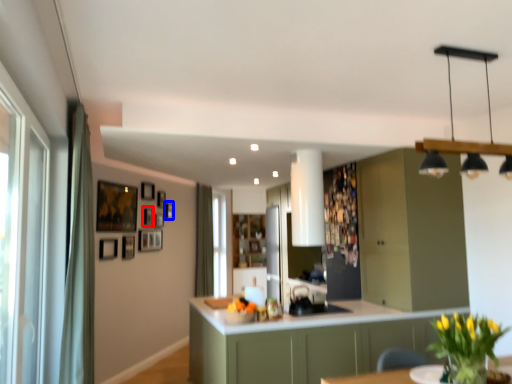
Question: Which object appears farthest to the camera in this image, picture frame (highlighted by a red box) or picture frame (highlighted by a blue box)?

Choices:
 (A) picture frame
 (B) picture frame

Answer: (B)